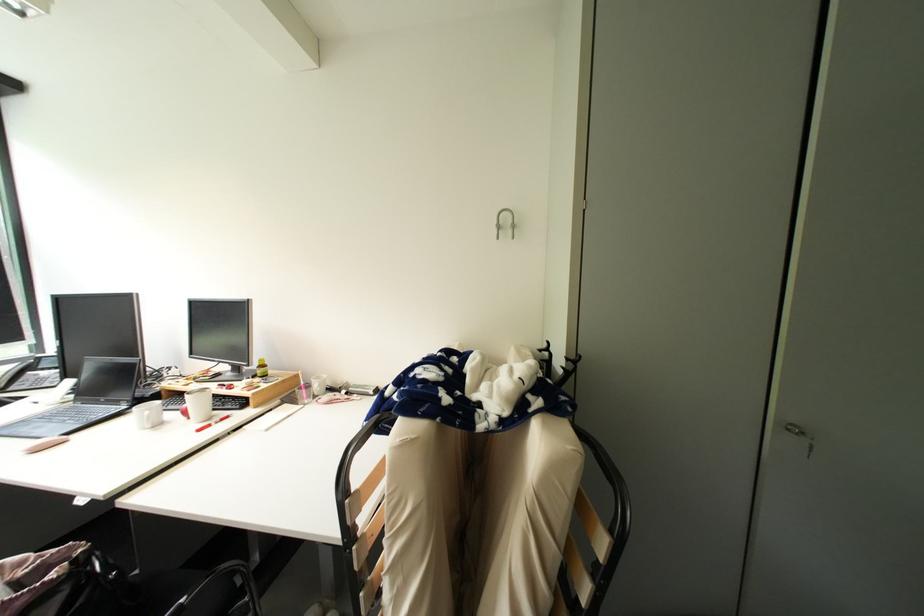
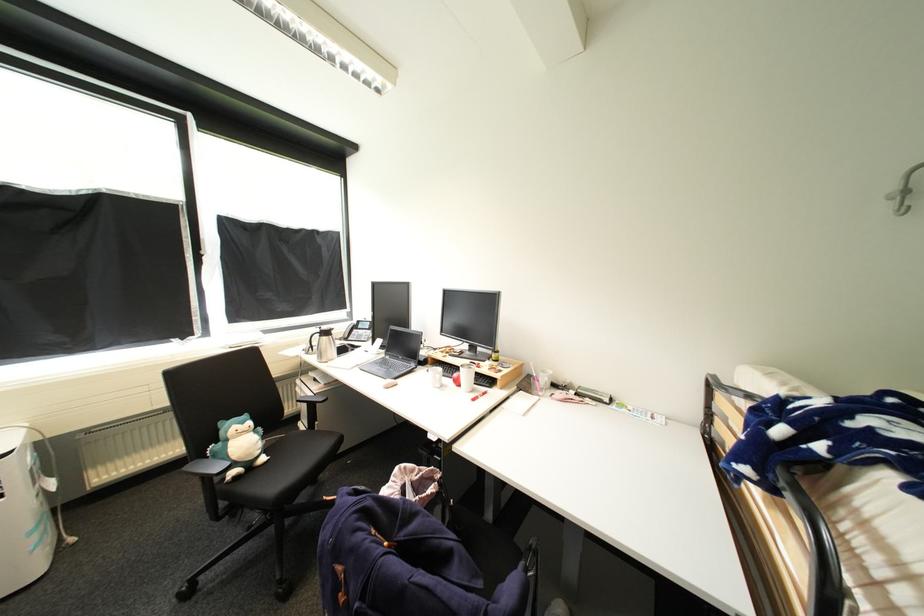
The point at (309, 402) is marked in the first image. Where is the corresponding point in the second image?

(541, 392)